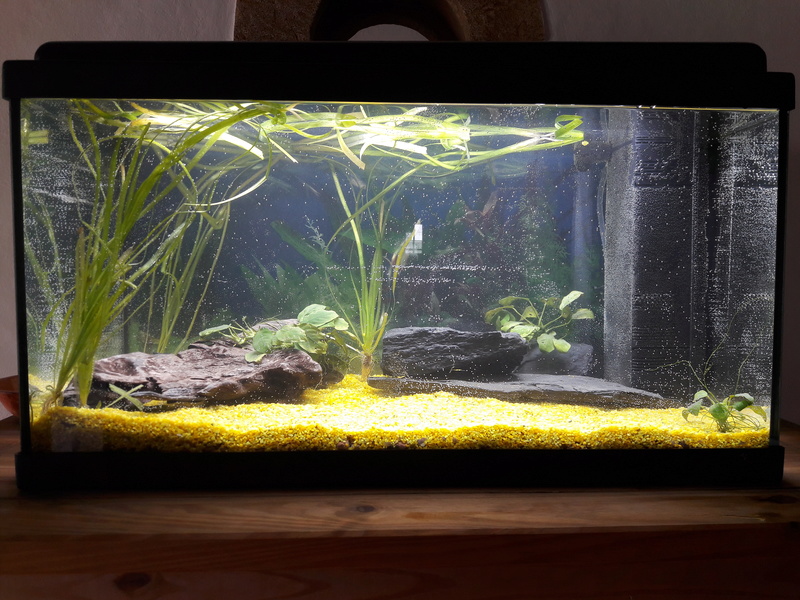
Where is `knots in wood`? The height and width of the screenshot is (600, 800). knots in wood is located at coordinates (362, 509), (130, 582), (770, 518).